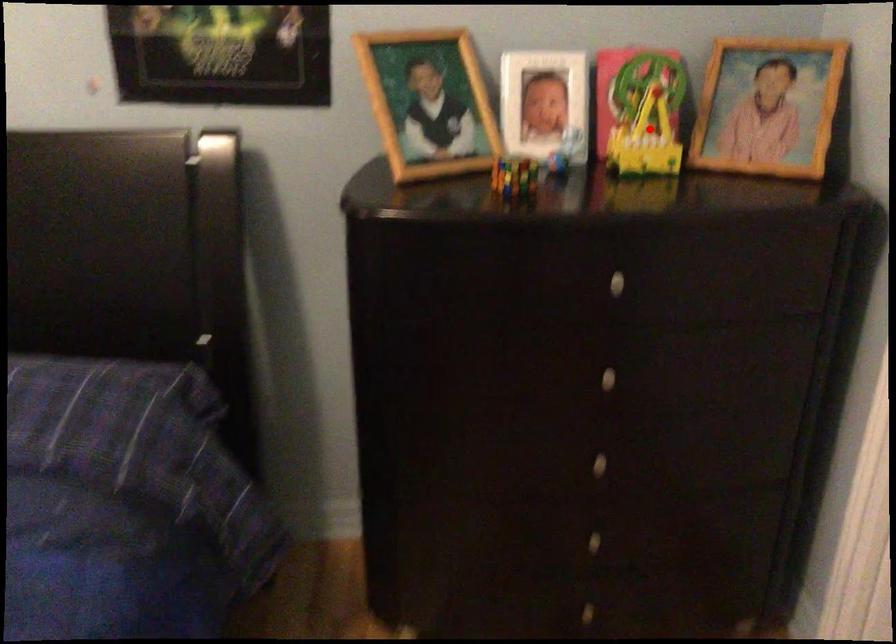
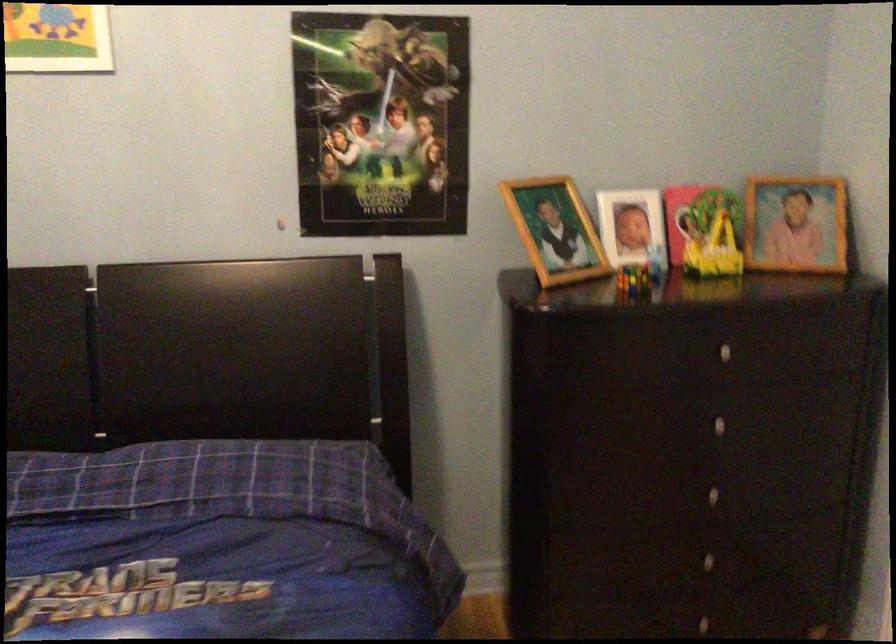
Locate, in the second image, the point that corresponds to the highlighted location in the first image.

(719, 240)